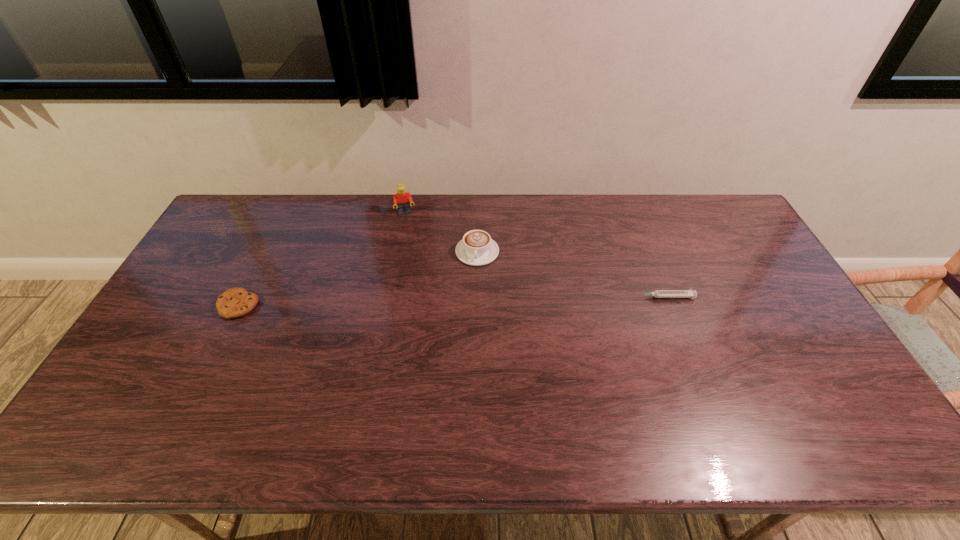
In order to click on free point between the cookie and the cappuccino in this screenshot , I will do `click(358, 279)`.

Identify which object is located as the nearest to the shortest object. Please provide its 2D coordinates. Your answer should be formatted as a tuple, i.e. [(x, y)], where the tuple contains the x and y coordinates of a point satisfying the conditions above.

[(476, 248)]

The image size is (960, 540). In order to click on the closest object relative to the Lego in this screenshot , I will do `click(476, 248)`.

I want to click on blank space that satisfies the following two spatial constraints: 1. on the back side of the rightmost object; 2. at the needle end of the cookie, so click(x=243, y=297).